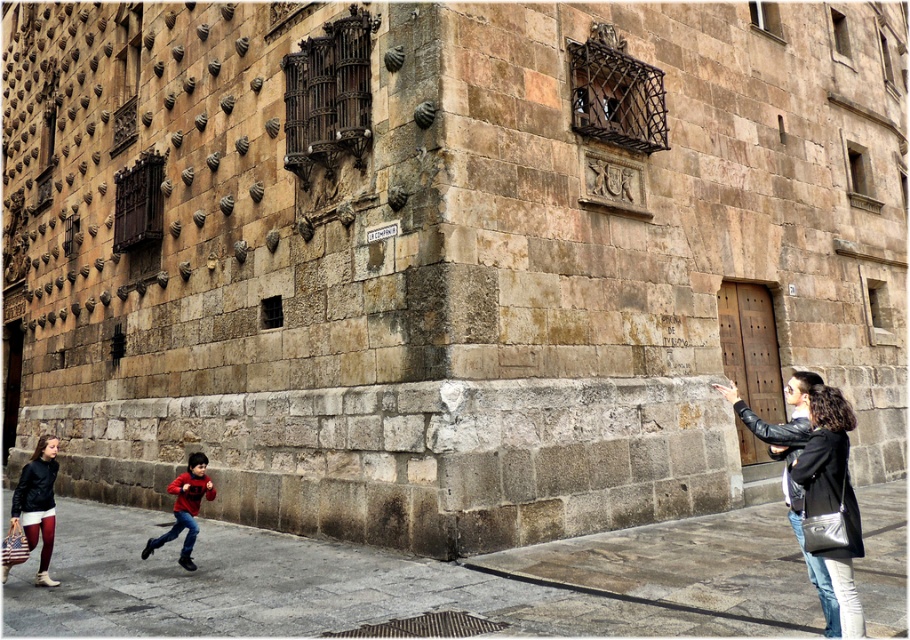
Can you confirm if leather jacket at lower right is positioned below matte red sweater at lower left?

Incorrect, leather jacket at lower right is not positioned below matte red sweater at lower left.

Based on the photo, can you confirm if leather jacket at lower right is shorter than matte red sweater at lower left?

No, leather jacket at lower right is not shorter than matte red sweater at lower left.

You are a GUI agent. You are given a task and a screenshot of the screen. Output one action in this format:
    pyautogui.click(x=<x>, y=<y>)
    Task: Click on the leather jacket at lower right
    
    Given the screenshot: What is the action you would take?
    pyautogui.click(x=814, y=481)

Describe the element at coordinates (814, 481) in the screenshot. This screenshot has width=910, height=640. I see `leather jacket at lower right` at that location.

Between point (755, 416) and point (39, 497), which one is positioned in front?

Point (755, 416) is more forward.

You are a GUI agent. You are given a task and a screenshot of the screen. Output one action in this format:
    pyautogui.click(x=<x>, y=<y>)
    Task: Click on the leather jacket at lower right
    
    Given the screenshot: What is the action you would take?
    pyautogui.click(x=814, y=481)

Does matte black jacket at lower left appear on the right side of matte red sweater at lower left?

In fact, matte black jacket at lower left is to the left of matte red sweater at lower left.

Is matte black jacket at lower left above matte red sweater at lower left?

Correct, matte black jacket at lower left is located above matte red sweater at lower left.

Between point (43, 509) and point (195, 509), which one is positioned behind?

Point (195, 509)

Locate an element on the screen. matte black jacket at lower left is located at coordinates (38, 502).